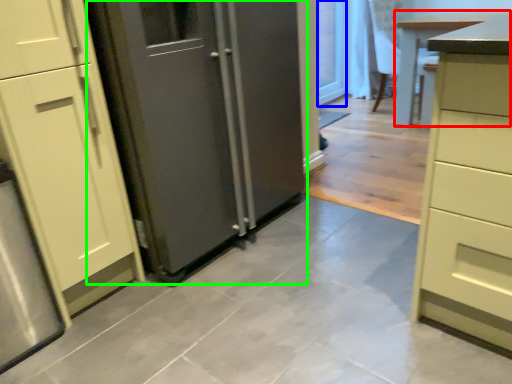
Question: Considering the real-world distances, which object is closest to table (highlighted by a red box)? glass door (highlighted by a blue box) or door (highlighted by a green box).

Choices:
 (A) glass door
 (B) door

Answer: (A)